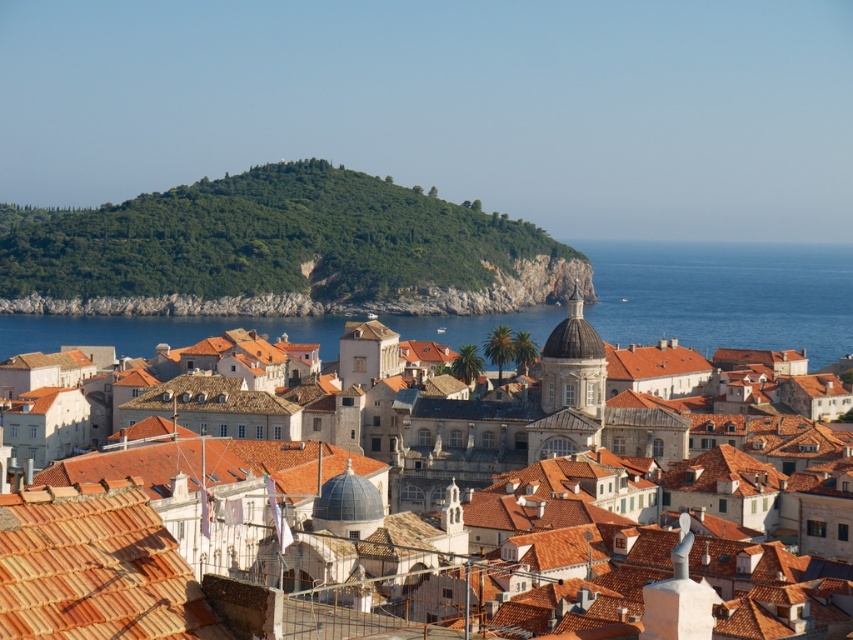
Question: Which of the following is the farthest from the observer?

Choices:
 (A) (357, 515)
 (B) (822, 248)

Answer: (B)

Question: Is terracotta tiles at lower left above matte orange tile roofs at center?

Choices:
 (A) yes
 (B) no

Answer: (A)

Question: Does blue water at center appear over matte orange tile roofs at center?

Choices:
 (A) yes
 (B) no

Answer: (A)

Question: Is terracotta tiles at lower left wider than matte orange tile roofs at center?

Choices:
 (A) no
 (B) yes

Answer: (A)

Question: Which of the following is the farthest from the observer?

Choices:
 (A) blue water at center
 (B) terracotta tiles at lower left
 (C) matte orange tile roofs at center

Answer: (A)

Question: Which object appears farthest from the camera in this image?

Choices:
 (A) blue water at center
 (B) terracotta tiles at lower left
 (C) matte orange tile roofs at center

Answer: (A)